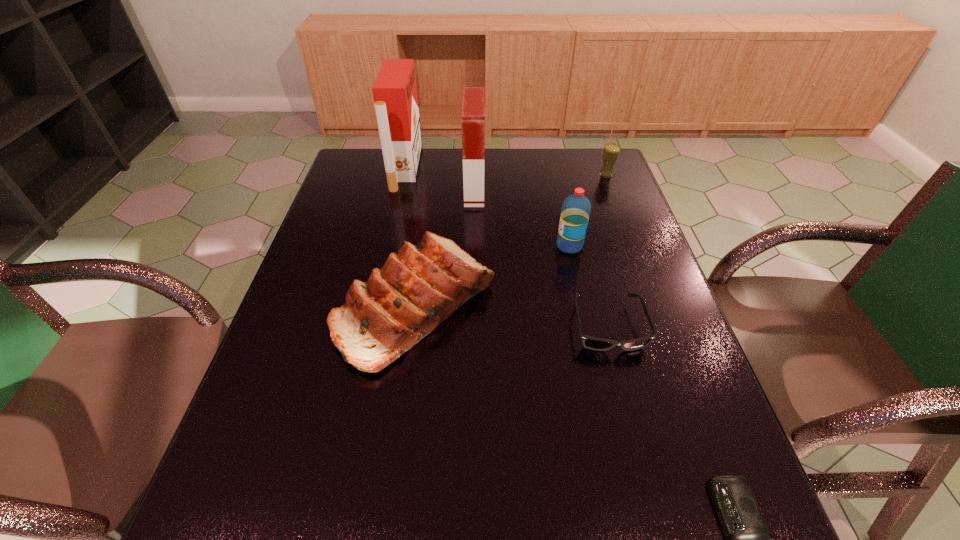
In order to click on free space located on the front label of the water bottle in this screenshot , I will do `click(435, 246)`.

Identify the location of vacant region located 0.170m on the left of the straw for drinking. (546, 174).

I want to click on vacant area located 0.400m on the back of the bread, so click(435, 170).

Image resolution: width=960 pixels, height=540 pixels. What are the coordinates of `free space located 0.320m on the front-facing side of the sunglasses` in the screenshot? It's located at (658, 518).

Where is `straw for drinking located at the far edge`? This screenshot has width=960, height=540. straw for drinking located at the far edge is located at coordinates (611, 151).

Find the location of a particular element. The width and height of the screenshot is (960, 540). cigarette case present at the left edge is located at coordinates tap(394, 91).

This screenshot has height=540, width=960. In order to click on bread present at the left edge in this screenshot , I will do `click(419, 287)`.

I want to click on straw for drinking that is at the right edge, so click(611, 151).

Identify the location of sunglasses situated at the right edge. The width and height of the screenshot is (960, 540). (594, 343).

Find the location of a particular element. Image resolution: width=960 pixels, height=540 pixels. object that is positioned at the far left corner is located at coordinates (x=394, y=91).